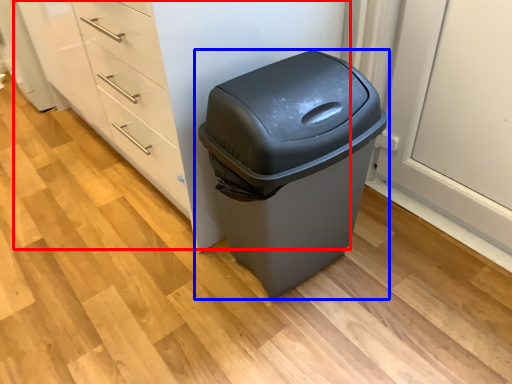
Question: Among these objects, which one is farthest to the camera, dresser (highlighted by a red box) or waste container (highlighted by a blue box)?

Choices:
 (A) dresser
 (B) waste container

Answer: (A)